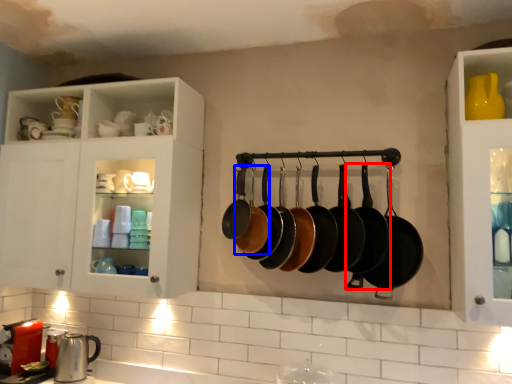
Question: Among these objects, which one is farthest to the camera, frying pan (highlighted by a red box) or frying pan (highlighted by a blue box)?

Choices:
 (A) frying pan
 (B) frying pan

Answer: (B)